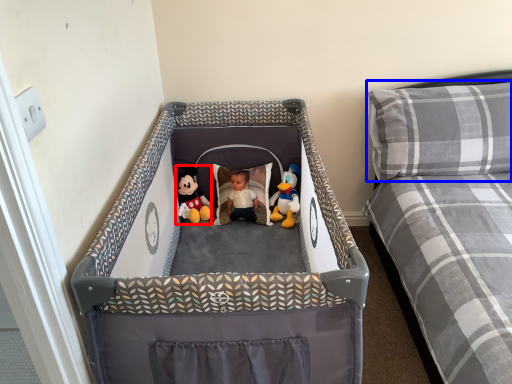
Question: Which object appears farthest to the camera in this image, toy (highlighted by a red box) or pillow (highlighted by a blue box)?

Choices:
 (A) toy
 (B) pillow

Answer: (A)